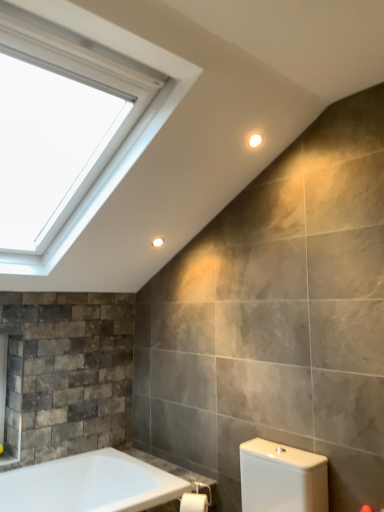
Question: Is white glossy bathtub at lower left not inside matte white light fixture at upper center, which is the second light fixture from top to bottom?

Choices:
 (A) yes
 (B) no

Answer: (A)

Question: From the image's perspective, is white glossy bathtub at lower left on matte white light fixture at upper center, positioned as the 2th light fixture in right-to-left order?

Choices:
 (A) yes
 (B) no

Answer: (B)

Question: Does white glossy bathtub at lower left appear on the left side of matte white light fixture at upper center, the first light fixture in the left-to-right sequence?

Choices:
 (A) no
 (B) yes

Answer: (A)

Question: Does white glossy bathtub at lower left have a greater height compared to matte white light fixture at upper center, arranged as the first light fixture when ordered from the bottom?

Choices:
 (A) no
 (B) yes

Answer: (A)

Question: Is white glossy bathtub at lower left wider than matte white light fixture at upper center, positioned as the 2th light fixture in right-to-left order?

Choices:
 (A) no
 (B) yes

Answer: (B)

Question: In the image, is matte white light fixture at upper center, positioned as the 2th light fixture in right-to-left order, on the left side or the right side of white matte toilet paper at lower center?

Choices:
 (A) left
 (B) right

Answer: (A)

Question: Is matte white light fixture at upper center, arranged as the 2th light fixture when viewed from the front, in front of or behind white matte toilet paper at lower center in the image?

Choices:
 (A) behind
 (B) front

Answer: (A)

Question: Based on their sizes in the image, would you say matte white light fixture at upper center, arranged as the first light fixture when ordered from the bottom, is bigger or smaller than white matte toilet paper at lower center?

Choices:
 (A) big
 (B) small

Answer: (B)

Question: From the image's perspective, is matte white light fixture at upper center, the first light fixture when ordered from back to front, positioned above or below white matte toilet paper at lower center?

Choices:
 (A) above
 (B) below

Answer: (A)

Question: Do you think white glossy bathtub at lower left is within matte white light fixture at upper center, arranged as the first light fixture when ordered from the bottom, or outside of it?

Choices:
 (A) outside
 (B) inside

Answer: (A)

Question: Based on their positions, is white glossy bathtub at lower left located to the left or right of matte white light fixture at upper center, positioned as the 2th light fixture in right-to-left order?

Choices:
 (A) right
 (B) left

Answer: (A)

Question: From their relative heights in the image, would you say white glossy bathtub at lower left is taller or shorter than matte white light fixture at upper center, positioned as the 2th light fixture in right-to-left order?

Choices:
 (A) short
 (B) tall

Answer: (A)

Question: Relative to matte white light fixture at upper center, the first light fixture when ordered from back to front, is white glossy bathtub at lower left in front or behind?

Choices:
 (A) behind
 (B) front

Answer: (B)

Question: From the image's perspective, relative to matte white light fixture at upper center, arranged as the first light fixture when ordered from the bottom, is white matte toilet paper at lower center above or below?

Choices:
 (A) above
 (B) below

Answer: (B)

Question: Considering the positions of point (198, 494) and point (160, 242), is point (198, 494) closer or farther from the camera than point (160, 242)?

Choices:
 (A) closer
 (B) farther

Answer: (A)